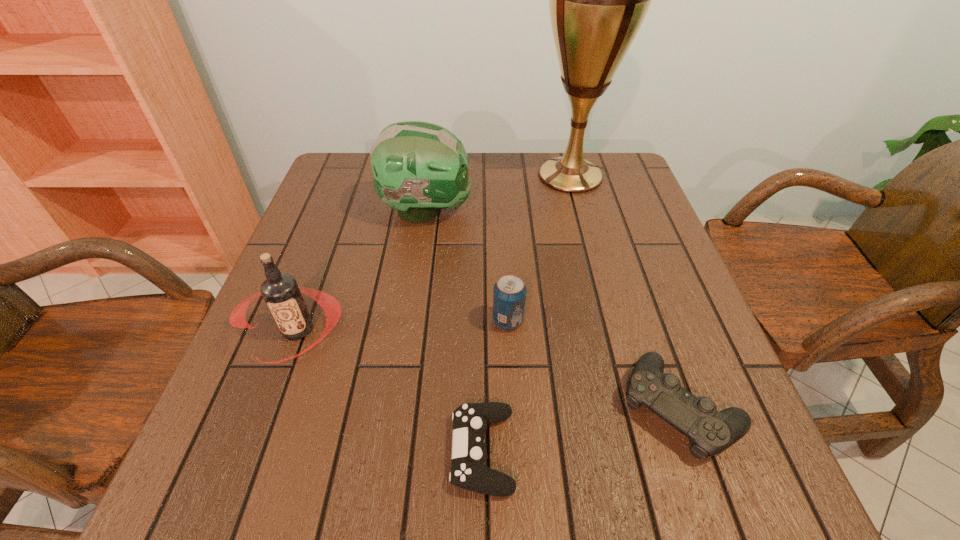
At what (x,y) coordinates should I click in order to perform the action: click on the tallest object. Please return your answer as a coordinate pair (x, y). The width and height of the screenshot is (960, 540). Looking at the image, I should click on (598, 0).

The height and width of the screenshot is (540, 960). Find the location of `the second tallest object`. the second tallest object is located at coordinates (419, 168).

Identify the location of the third tallest object. This screenshot has height=540, width=960. (281, 293).

Where is `the leftmost object`? The width and height of the screenshot is (960, 540). the leftmost object is located at coordinates (281, 293).

Find the location of a particular element. the fourth tallest object is located at coordinates (509, 293).

Find the location of a particular element. the fifth tallest object is located at coordinates (711, 432).

Where is `the right control`? The image size is (960, 540). the right control is located at coordinates (711, 432).

At what (x,y) coordinates should I click in order to perform the action: click on the shorter control. Please return your answer as a coordinate pair (x, y). This screenshot has height=540, width=960. Looking at the image, I should click on (470, 420).

Locate an element on the screen. The width and height of the screenshot is (960, 540). the shortest object is located at coordinates (470, 420).

You are a GUI agent. You are given a task and a screenshot of the screen. Output one action in this format:
    pyautogui.click(x=<x>, y=<y>)
    Task: Click on the free location located 0.190m on the left of the trophy cup
    This screenshot has height=540, width=960.
    Given the screenshot: What is the action you would take?
    pyautogui.click(x=464, y=176)